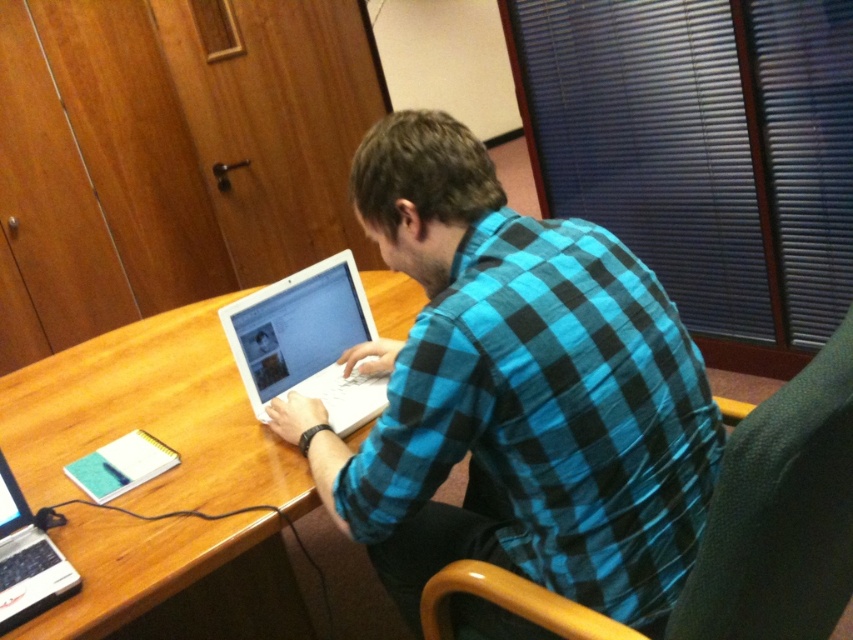
Question: Does wooden table at center appear on the left side of white glossy laptop at center?

Choices:
 (A) yes
 (B) no

Answer: (A)

Question: Does blue checkered shirt at center appear under wooden table at center?

Choices:
 (A) no
 (B) yes

Answer: (A)

Question: Can you confirm if wooden table at center is positioned to the left of white glossy laptop at center?

Choices:
 (A) no
 (B) yes

Answer: (B)

Question: Estimate the real-world distances between objects in this image. Which object is farther from the silver metallic laptop at lower left?

Choices:
 (A) wooden table at center
 (B) white glossy laptop at center
 (C) blue checkered shirt at center

Answer: (C)

Question: Among these objects, which one is nearest to the camera?

Choices:
 (A) white glossy laptop at center
 (B) blue checkered shirt at center

Answer: (B)

Question: Which point is farther to the camera?

Choices:
 (A) wooden table at center
 (B) white glossy laptop at center
 (C) blue checkered shirt at center

Answer: (B)